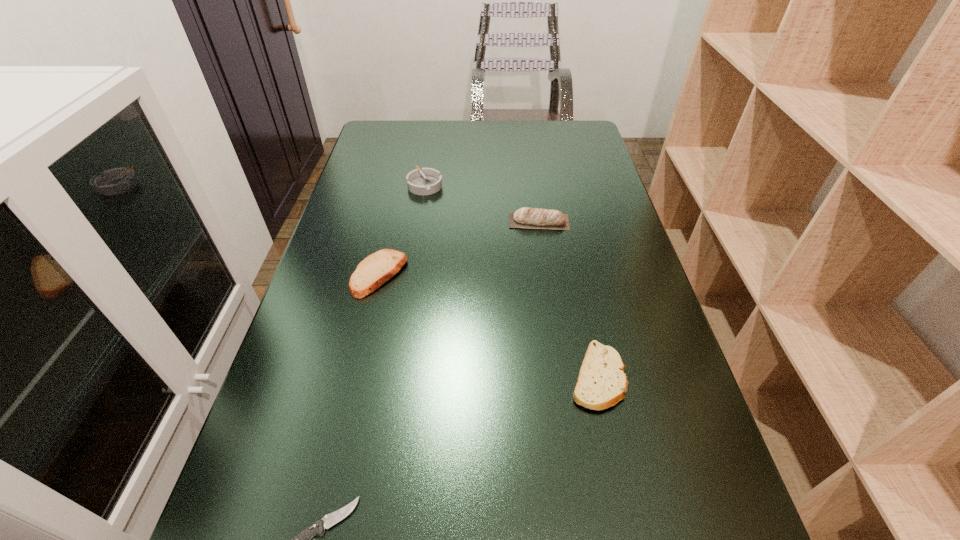
Identify the location of the farthest pita bread. The width and height of the screenshot is (960, 540). (533, 218).

Where is `the fourth nearest object`? the fourth nearest object is located at coordinates (533, 218).

You are a GUI agent. You are given a task and a screenshot of the screen. Output one action in this format:
    pyautogui.click(x=<x>, y=<y>)
    Task: Click on the ashtray
    The width and height of the screenshot is (960, 540).
    Given the screenshot: What is the action you would take?
    pyautogui.click(x=428, y=181)

In order to click on the third tallest object in this screenshot , I will do `click(376, 269)`.

Locate an element on the screen. This screenshot has width=960, height=540. the second tallest pita bread is located at coordinates (376, 269).

I want to click on the shortest pita bread, so tap(602, 383).

This screenshot has height=540, width=960. What are the coordinates of `the second nearest object` in the screenshot? It's located at (602, 383).

Find the location of a particular element. vacant position located on the back of the second farthest object is located at coordinates (531, 171).

The height and width of the screenshot is (540, 960). What are the coordinates of `vacant space located on the right of the ashtray` in the screenshot? It's located at (581, 185).

What are the coordinates of `blank space located 0.180m on the back of the third tallest object` in the screenshot? It's located at (395, 208).